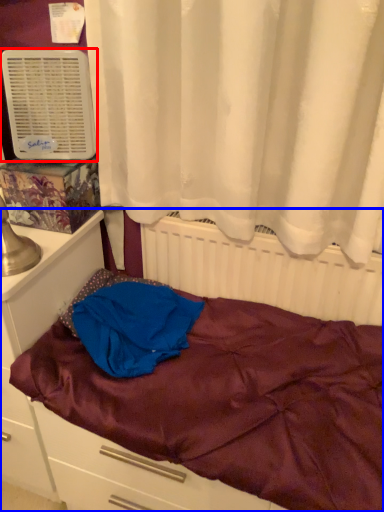
Question: Among these objects, which one is farthest to the camera, air conditioning (highlighted by a red box) or bed (highlighted by a blue box)?

Choices:
 (A) air conditioning
 (B) bed

Answer: (A)